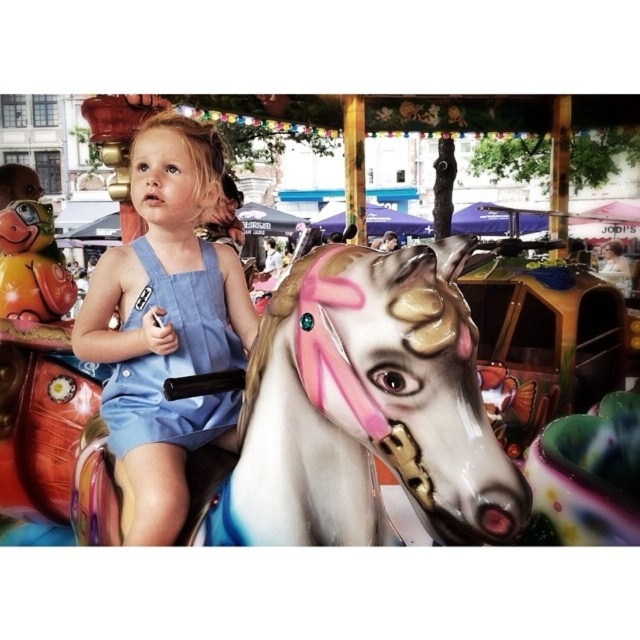
Is blue denim dress at center taller than denim overalls at center?

Yes.

Who is more forward, (x=186, y=340) or (x=141, y=356)?

Positioned in front is point (x=186, y=340).

Is point (244, 321) positioned before point (128, 387)?

No, it is behind (128, 387).

Locate an element on the screen. blue denim dress at center is located at coordinates (166, 321).

Is shiny metallic carousel horse at center below blue denim dress at center?

Correct, shiny metallic carousel horse at center is located below blue denim dress at center.

Between point (252, 380) and point (147, 228), which one is positioned behind?

Point (147, 228)

I want to click on shiny metallic carousel horse at center, so click(x=365, y=408).

Is shiny metallic carousel horse at center positioned behind denim overalls at center?

No, it is not.

Which of these two, shiny metallic carousel horse at center or denim overalls at center, stands shorter?

With less height is denim overalls at center.

At what (x,y) coordinates should I click in order to perform the action: click on shiny metallic carousel horse at center. Please return your answer as a coordinate pair (x, y). This screenshot has width=640, height=640. Looking at the image, I should click on (365, 408).